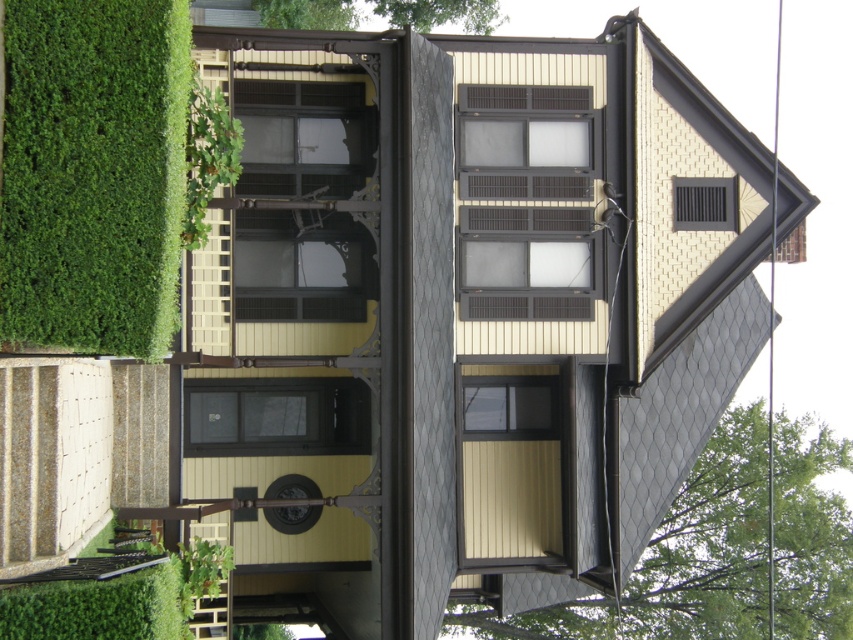
You are standing in front of the Victorian house and notice the green leafy hedge at left and the green leafy tree at upper right. Which one appears nearer to you?

The green leafy hedge at left is closer to the viewer than the green leafy tree at upper right.

You are standing in front of the Victorian house and notice two green leafy hedges. One is labeled as the green leafy hedge at left, and the other is the green leafy hedge at lower left. Based on their positions, which hedge is positioned higher from the ground?

The green leafy hedge at left is positioned higher from the ground than the green leafy hedge at lower left because it is located above it.